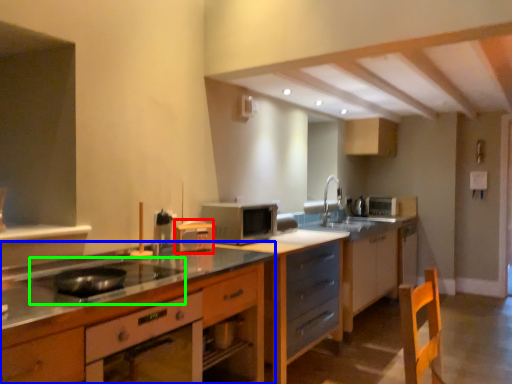
Question: Which object is the farthest from appliance (highlighted by a red box)? Choose among these: cabinetry (highlighted by a blue box) or gas stove (highlighted by a green box).

Choices:
 (A) cabinetry
 (B) gas stove

Answer: (B)